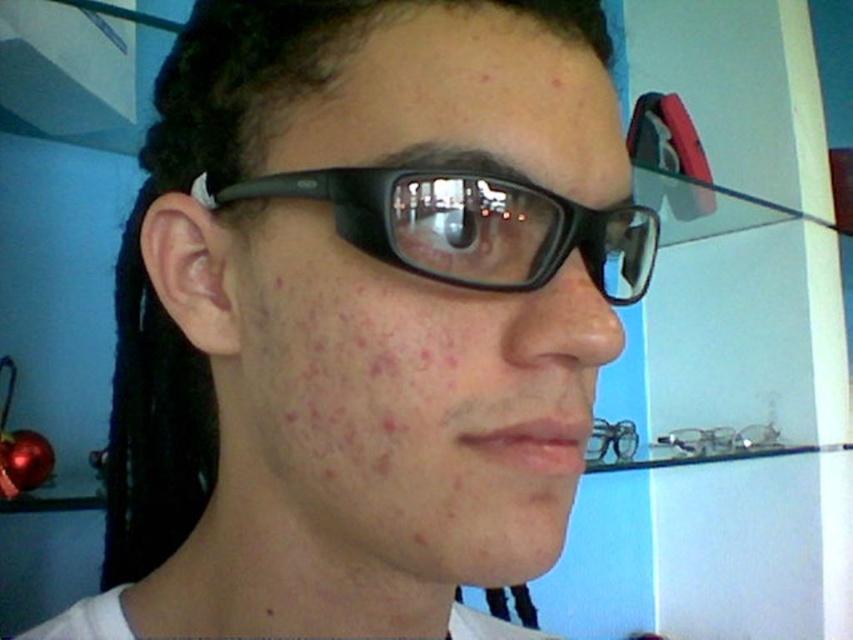
Is matte black glasses at center positioned before matte black glasses at upper center?

Yes.

Is matte black glasses at center to the right of matte black glasses at upper center from the viewer's perspective?

Incorrect, matte black glasses at center is not on the right side of matte black glasses at upper center.

Is point (518, 138) positioned in front of point (285, 144)?

Yes, point (518, 138) is in front of point (285, 144).

Find the location of a particular element. matte black glasses at center is located at coordinates (395, 406).

Does matte black glasses at upper center appear over black plastic glasses at center?

Yes.

Is matte black glasses at upper center bigger than black plastic glasses at center?

Actually, matte black glasses at upper center might be smaller than black plastic glasses at center.

This screenshot has height=640, width=853. What are the coordinates of `matte black glasses at upper center` in the screenshot? It's located at (x=447, y=92).

Does point (311, 556) come behind point (532, 264)?

Yes, point (311, 556) is farther from viewer.

Who is positioned more to the left, matte black glasses at center or black plastic glasses at center?

Positioned to the left is matte black glasses at center.

Identify the location of matte black glasses at center. Image resolution: width=853 pixels, height=640 pixels. (395, 406).